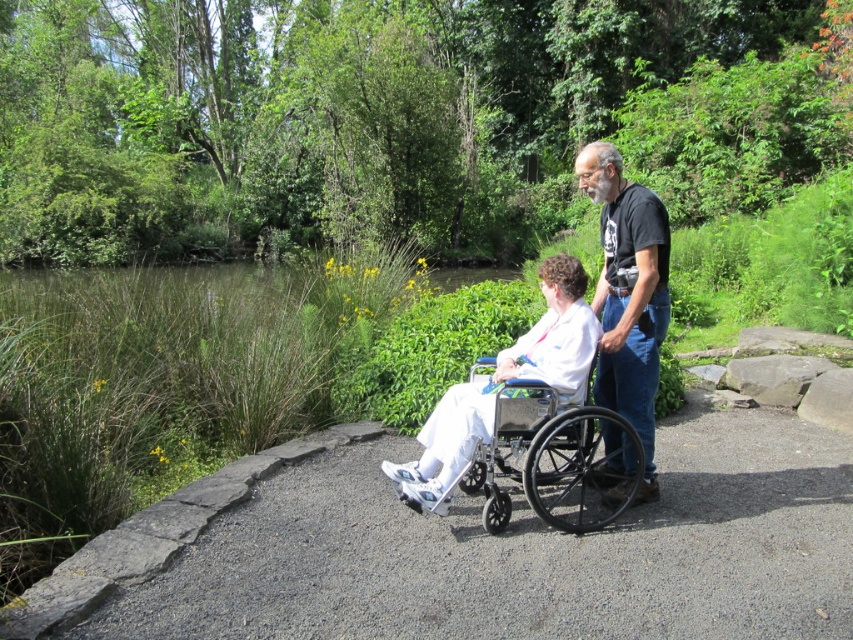
Is metallic silver wheelchair at center positioned before black t-shirt at upper center?

That is True.

Between metallic silver wheelchair at center and black t-shirt at upper center, which one is positioned lower?

black t-shirt at upper center is below.

Between point (531, 445) and point (647, 353), which one is positioned in front?

Point (531, 445)

Locate an element on the screen. The height and width of the screenshot is (640, 853). metallic silver wheelchair at center is located at coordinates [x=554, y=460].